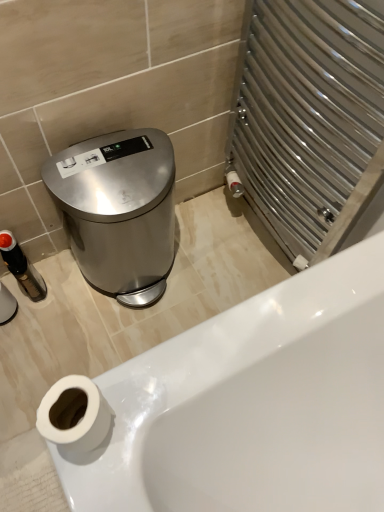
Find the location of a particular element. This screenshot has width=384, height=512. unoccupied region to the right of polished stainless steel trash can at left is located at coordinates click(211, 266).